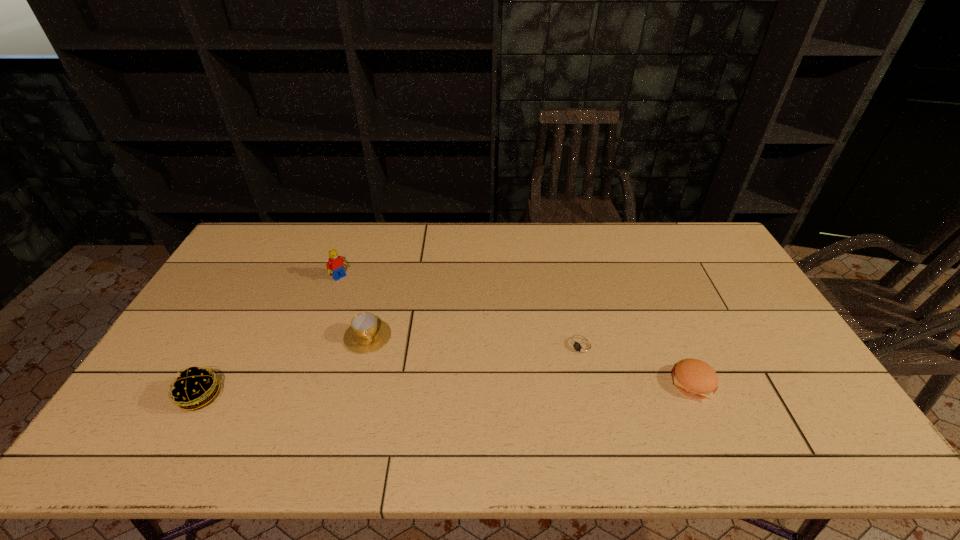
The width and height of the screenshot is (960, 540). What are the coordinates of `the leftmost object` in the screenshot? It's located at (194, 388).

Where is `the taller patty`? The image size is (960, 540). the taller patty is located at coordinates (194, 388).

This screenshot has height=540, width=960. I want to click on the second shortest object, so coord(695,378).

This screenshot has height=540, width=960. Find the location of `the shorter patty`. the shorter patty is located at coordinates (695, 378).

Where is `the third object from right to left`? The width and height of the screenshot is (960, 540). the third object from right to left is located at coordinates (366, 334).

You are a GUI agent. You are given a task and a screenshot of the screen. Output one action in this format:
    pyautogui.click(x=<x>, y=<y>)
    Task: Click on the watch
    This screenshot has width=960, height=540.
    Given the screenshot: What is the action you would take?
    pyautogui.click(x=582, y=347)

Identify the location of the second object from right to left. (582, 347).

This screenshot has width=960, height=540. Identify the location of the tallest object. (335, 265).

The height and width of the screenshot is (540, 960). Find the location of `Lego`. Lego is located at coordinates (335, 265).

At what (x,y) coordinates should I click in order to perform the action: click on vacant region located on the back of the taller patty. Please return your answer as a coordinate pair (x, y). Looking at the image, I should click on (231, 341).